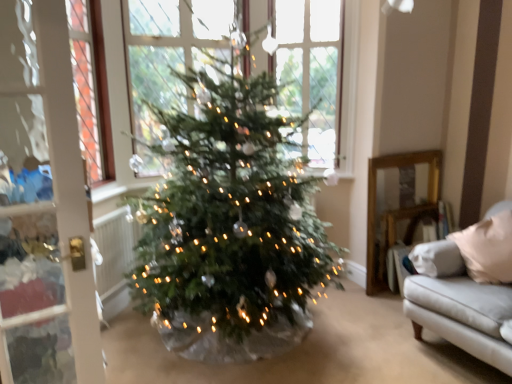
Question: Does clear glass window at upper center contain white fabric couch at right?

Choices:
 (A) yes
 (B) no

Answer: (B)

Question: Is clear glass window at upper center wider than white fabric couch at right?

Choices:
 (A) yes
 (B) no

Answer: (A)

Question: From the image's perspective, is clear glass window at upper center on white fabric couch at right?

Choices:
 (A) yes
 (B) no

Answer: (A)

Question: Is the surface of clear glass window at upper center in direct contact with white fabric couch at right?

Choices:
 (A) no
 (B) yes

Answer: (A)

Question: Is clear glass window at upper center not near white fabric couch at right?

Choices:
 (A) no
 (B) yes

Answer: (A)

Question: Is clear glass window at upper center positioned beyond the bounds of white fabric couch at right?

Choices:
 (A) yes
 (B) no

Answer: (A)

Question: Could you tell me if white fabric couch at right is turned towards clear glass window at upper center?

Choices:
 (A) no
 (B) yes

Answer: (A)

Question: From the image's perspective, is white fabric couch at right located above clear glass window at upper center?

Choices:
 (A) yes
 (B) no

Answer: (B)

Question: Is white fabric couch at right in front of clear glass window at upper center?

Choices:
 (A) no
 (B) yes

Answer: (A)

Question: Are white fabric couch at right and clear glass window at upper center beside each other?

Choices:
 (A) no
 (B) yes

Answer: (A)

Question: Can you confirm if white fabric couch at right is smaller than clear glass window at upper center?

Choices:
 (A) no
 (B) yes

Answer: (B)

Question: Is the depth of white fabric couch at right greater than that of clear glass window at upper center?

Choices:
 (A) no
 (B) yes

Answer: (B)

Question: From a real-world perspective, is clear glass window at upper center above or below white fabric couch at right?

Choices:
 (A) above
 (B) below

Answer: (A)